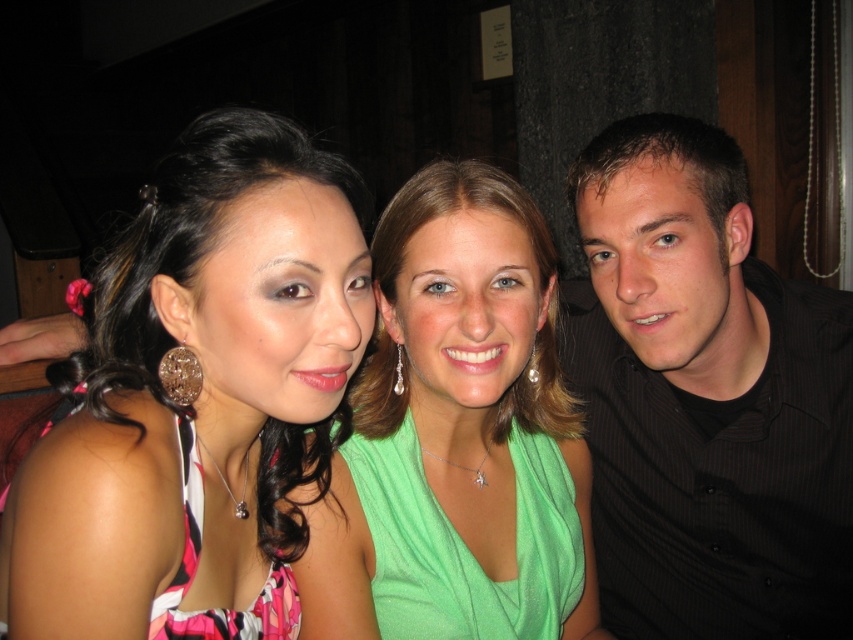
Question: Among these objects, which one is nearest to the camera?

Choices:
 (A) black striped shirt at right
 (B) pink printed dress at center
 (C) green satin dress at center

Answer: (B)

Question: Does pink printed dress at center appear on the right side of black striped shirt at right?

Choices:
 (A) yes
 (B) no

Answer: (B)

Question: Can you confirm if pink printed dress at center is positioned above black striped shirt at right?

Choices:
 (A) yes
 (B) no

Answer: (A)

Question: Which of the following is the farthest from the observer?

Choices:
 (A) black striped shirt at right
 (B) pink printed dress at center

Answer: (A)

Question: Which point is closer to the camera taking this photo?

Choices:
 (A) (770, 582)
 (B) (97, 292)

Answer: (B)

Question: From the image, what is the correct spatial relationship of pink printed dress at center in relation to black striped shirt at right?

Choices:
 (A) right
 (B) left

Answer: (B)